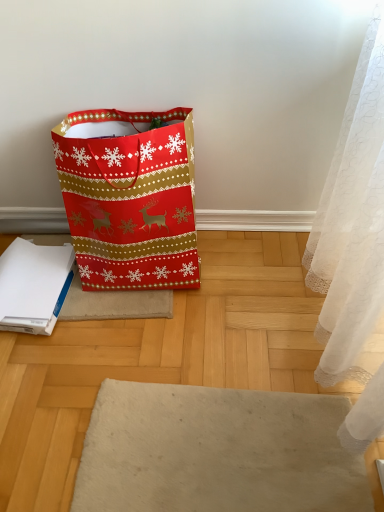
Describe the element at coordinates (130, 200) in the screenshot. This screenshot has height=512, width=384. I see `shiny paper bag at left` at that location.

Locate an element on the screen. This screenshot has height=512, width=384. shiny paper bag at left is located at coordinates (130, 200).

I want to click on white paper notebook at lower left, so click(x=33, y=285).

What do you see at coordinates (33, 285) in the screenshot? Image resolution: width=384 pixels, height=512 pixels. I see `white paper notebook at lower left` at bounding box center [33, 285].

Find the location of `shiny paper bag at left`. shiny paper bag at left is located at coordinates (130, 200).

Which is more to the right, white paper notebook at lower left or shiny paper bag at left?

Positioned to the right is shiny paper bag at left.

Considering the relative positions of white paper notebook at lower left and shiny paper bag at left in the image provided, is white paper notebook at lower left behind shiny paper bag at left?

Yes, it is.

Does point (1, 263) come farther from viewer compared to point (100, 138)?

Yes, point (1, 263) is behind point (100, 138).

From the image's perspective, which is above, white paper notebook at lower left or shiny paper bag at left?

shiny paper bag at left.

From a real-world perspective, is white paper notebook at lower left positioned under shiny paper bag at left based on gravity?

Yes.

Is white paper notebook at lower left wider than shiny paper bag at left?

No, white paper notebook at lower left is not wider than shiny paper bag at left.

Which of these two, white paper notebook at lower left or shiny paper bag at left, stands shorter?

white paper notebook at lower left is shorter.

Which of these two, white paper notebook at lower left or shiny paper bag at left, is smaller?

Smaller between the two is white paper notebook at lower left.

Based on the photo, would you say white paper notebook at lower left contains shiny paper bag at left?

No.

Does white paper notebook at lower left touch shiny paper bag at left?

No.

Could you tell me if white paper notebook at lower left is turned towards shiny paper bag at left?

No, white paper notebook at lower left does not turn towards shiny paper bag at left.

At what (x,y) coordinates should I click in order to perform the action: click on luggage and bags above the white paper notebook at lower left (from the image's perspective). Please return your answer as a coordinate pair (x, y). This screenshot has height=512, width=384. Looking at the image, I should click on (130, 200).

Considering the relative positions of shiny paper bag at left and white paper notebook at lower left in the image provided, is shiny paper bag at left to the left of white paper notebook at lower left from the viewer's perspective?

Incorrect, shiny paper bag at left is not on the left side of white paper notebook at lower left.

Relative to white paper notebook at lower left, is shiny paper bag at left in front or behind?

shiny paper bag at left is positioned closer to the viewer than white paper notebook at lower left.

Which is closer, (162, 159) or (71, 250)?

The point (162, 159) is closer to the camera.

From the image's perspective, which object appears higher, shiny paper bag at left or white paper notebook at lower left?

shiny paper bag at left.

From a real-world perspective, is shiny paper bag at left positioned under white paper notebook at lower left based on gravity?

No, from a real-world perspective, shiny paper bag at left is not below white paper notebook at lower left.

Is shiny paper bag at left wider than white paper notebook at lower left?

Correct, the width of shiny paper bag at left exceeds that of white paper notebook at lower left.

In the scene shown: In terms of height, does shiny paper bag at left look taller or shorter compared to white paper notebook at lower left?

Considering their sizes, shiny paper bag at left has more height than white paper notebook at lower left.

Considering the sizes of objects shiny paper bag at left and white paper notebook at lower left in the image provided, who is bigger, shiny paper bag at left or white paper notebook at lower left?

shiny paper bag at left is bigger.

Is shiny paper bag at left located outside white paper notebook at lower left?

Indeed, shiny paper bag at left is completely outside white paper notebook at lower left.

Are shiny paper bag at left and white paper notebook at lower left far apart?

No, shiny paper bag at left is not far from white paper notebook at lower left.

Consider the image. Could you tell me if shiny paper bag at left is facing white paper notebook at lower left?

No.

From the picture: Measure the distance from shiny paper bag at left to white paper notebook at lower left.

12.28 inches.

Where is `luggage and bags in front of the white paper notebook at lower left`? Image resolution: width=384 pixels, height=512 pixels. luggage and bags in front of the white paper notebook at lower left is located at coordinates (130, 200).

There is a white paper notebook at lower left. Where is `luggage and bags above it (from a real-world perspective)`? The image size is (384, 512). luggage and bags above it (from a real-world perspective) is located at coordinates (130, 200).

Locate an element on the screen. The width and height of the screenshot is (384, 512). luggage and bags on the right of white paper notebook at lower left is located at coordinates (130, 200).